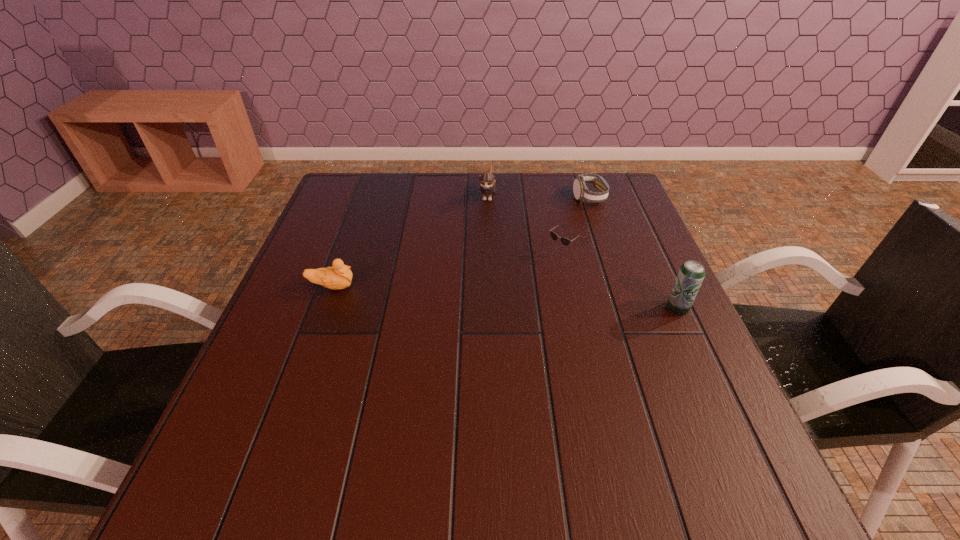
This screenshot has height=540, width=960. Identify the location of free space located 0.180m on the front of the rightmost object. (713, 385).

You are a GUI agent. You are given a task and a screenshot of the screen. Output one action in this format:
    pyautogui.click(x=<x>, y=<y>)
    Task: Click on the vacant space located on the face of the watch
    The image size is (960, 540).
    Given the screenshot: What is the action you would take?
    pyautogui.click(x=536, y=287)

This screenshot has height=540, width=960. What are the coordinates of `free space located 0.360m on the face of the watch` in the screenshot? It's located at (540, 280).

Image resolution: width=960 pixels, height=540 pixels. What are the coordinates of `free space located 0.370m on the face of the watch` in the screenshot? It's located at (539, 282).

Where is `vacant position located in front of the lenses of the third object from left to right`? The image size is (960, 540). vacant position located in front of the lenses of the third object from left to right is located at coordinates (468, 327).

Find the location of a particular element. free space located 0.390m in front of the lenses of the third object from left to right is located at coordinates (431, 357).

Find the location of a particular element. This screenshot has height=540, width=960. free space located 0.260m in front of the lenses of the third object from left to right is located at coordinates (474, 322).

This screenshot has width=960, height=540. What are the coordinates of `free space located on the front-facing side of the second tallest object` in the screenshot? It's located at (480, 235).

Identify the location of blank area located on the front-facing side of the second tallest object. This screenshot has width=960, height=540. (x=477, y=252).

I want to click on free space located 0.310m on the front-facing side of the second tallest object, so click(471, 277).